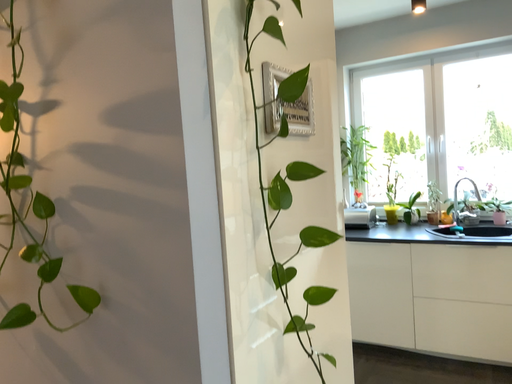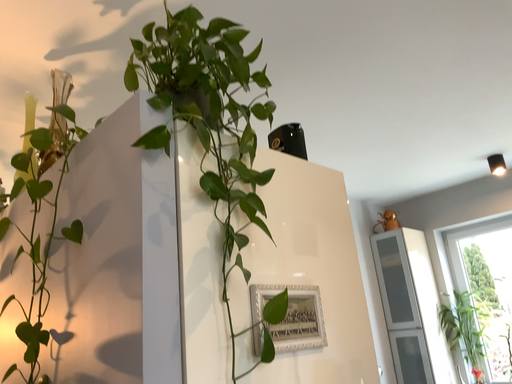
Question: How did the camera likely rotate when shooting the video?

Choices:
 (A) rotated left
 (B) rotated right

Answer: (A)